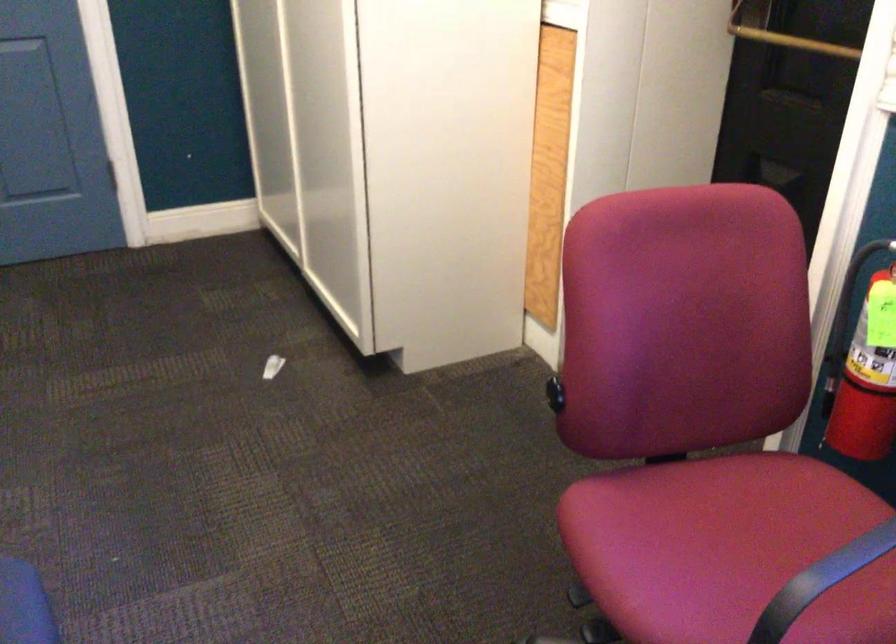
Where is `fire extinguisher pin`? fire extinguisher pin is located at coordinates (892, 269).